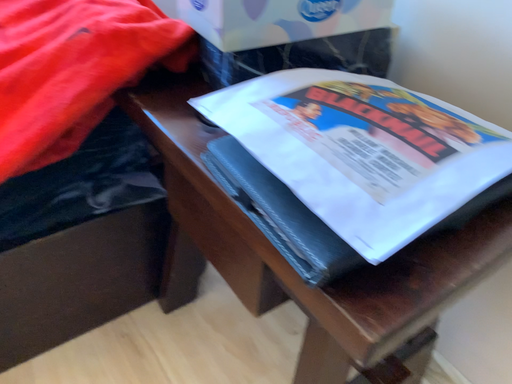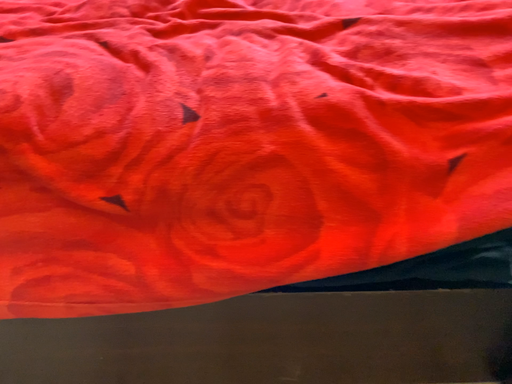
Question: Which way did the camera rotate in the video?

Choices:
 (A) rotated left
 (B) rotated right

Answer: (A)